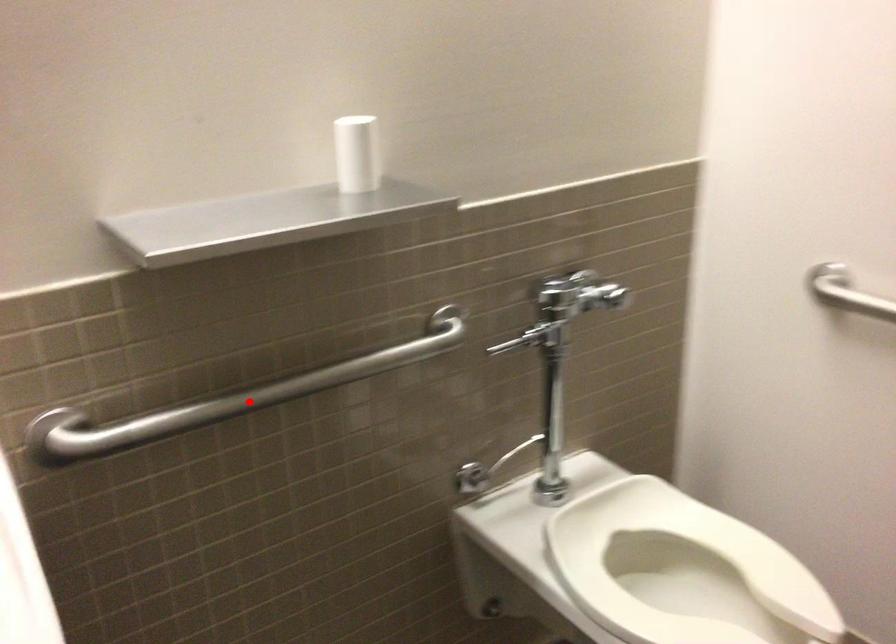
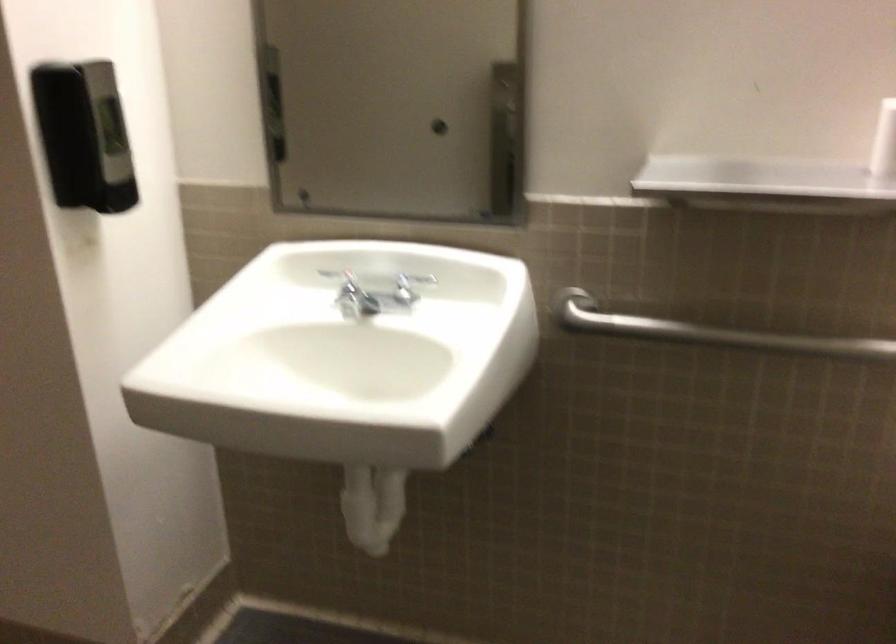
Question: I am providing you with two images of the same scene from different viewpoints. In image1, a red point is highlighted. Considering the same 3D point in image2, which of the following is correct?

Choices:
 (A) It is closer
 (B) It is farther

Answer: (B)